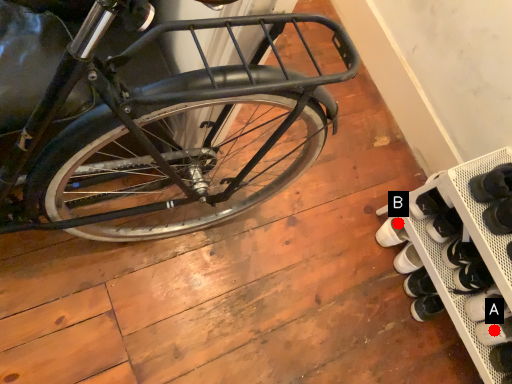
Question: Two points are circled on the image, labeled by A and B beside each circle. Among these points, which one is farthest from the camera?

Choices:
 (A) A is further
 (B) B is further

Answer: (B)